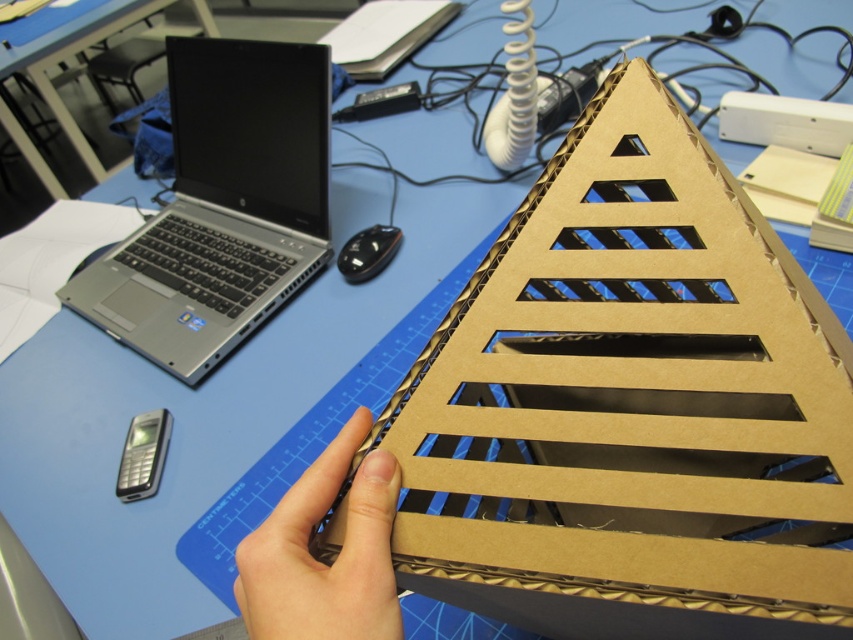
Question: Which of the following is the farthest from the observer?

Choices:
 (A) (337, 616)
 (B) (259, 186)

Answer: (B)

Question: Which point appears closest to the camera in this image?

Choices:
 (A) (381, 464)
 (B) (244, 241)

Answer: (A)

Question: Does silver/black plastic laptop at upper left have a greater width compared to brown cardboard hand at center?

Choices:
 (A) yes
 (B) no

Answer: (A)

Question: Which point is closer to the camera?

Choices:
 (A) brown cardboard hand at center
 (B) silver/black plastic laptop at upper left

Answer: (A)

Question: Can you confirm if silver/black plastic laptop at upper left is wider than brown cardboard hand at center?

Choices:
 (A) yes
 (B) no

Answer: (A)

Question: In this image, where is silver/black plastic laptop at upper left located relative to brown cardboard hand at center?

Choices:
 (A) left
 (B) right

Answer: (A)